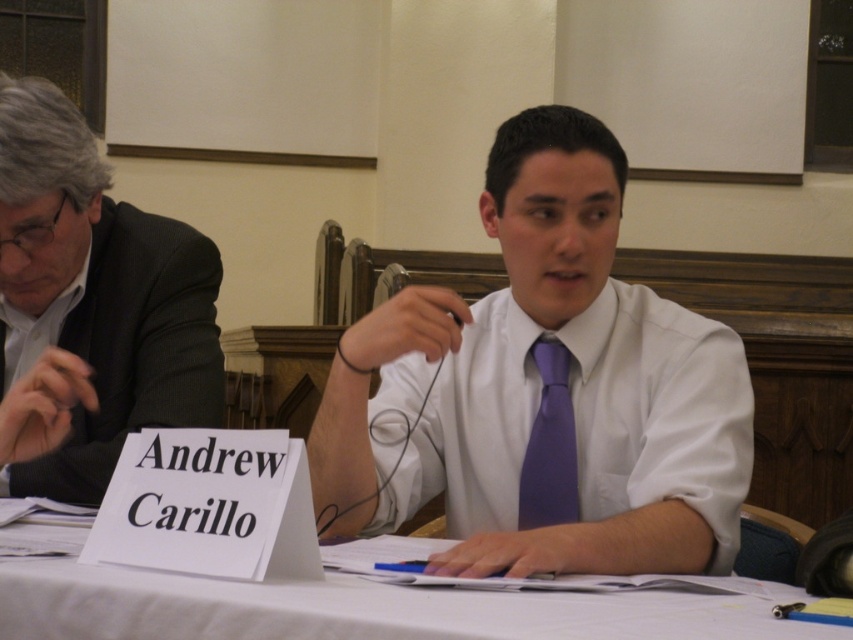
You are a tailor observing the two items on the table. The white glossy shirt at center and the purple satin tie at center are both placed in front of you. Which item occupies more horizontal space?

The white glossy shirt at center might be wider than purple satin tie at center, so it likely occupies more horizontal space.

In the scene shown: You are a photographer adjusting the lighting for a portrait of both individuals. Since the white glossy shirt at center and the purple satin tie at center are both in the frame, which one should you focus on to ensure proper exposure, considering their sizes?

The white glossy shirt at center is taller than the purple satin tie at center, so focusing on the white glossy shirt at center would ensure proper exposure as it occupies a larger area in the frame.